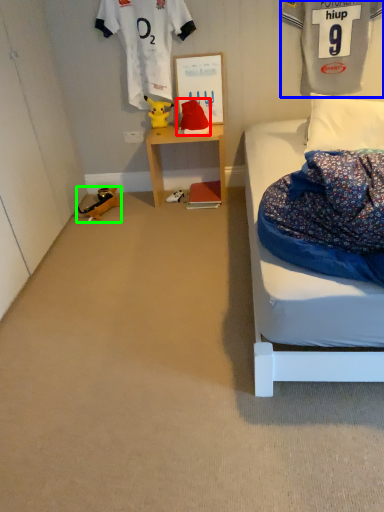
Question: Considering the real-world distances, which object is closest to toy (highlighted by a red box)? clothing (highlighted by a blue box) or toy (highlighted by a green box).

Choices:
 (A) clothing
 (B) toy

Answer: (B)